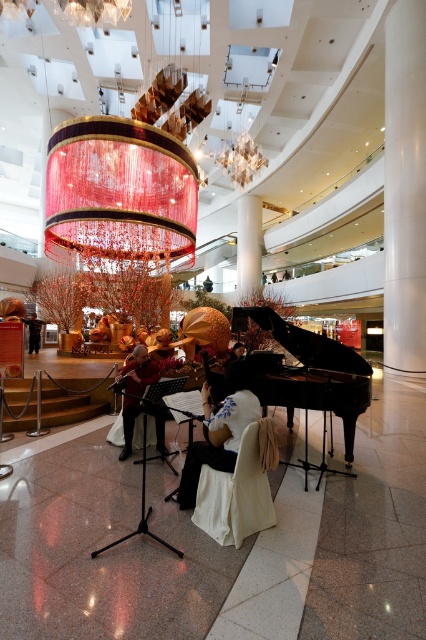
You are a photographer at the event and want to capture a photo of both the white satin dress at center and the dark brown leather jacket at center in the same frame. Which object should you focus on first to ensure both are in focus?

You should focus on the white satin dress at center first because it is smaller than the dark brown leather jacket at center, so focusing on the smaller object will help ensure both are in focus.

You are standing at the entrance of the atrium and want to find the black polished piano at center. According to the coordinates provided, where should you look relative to your current position?

The black polished piano at center is located at coordinates point (302,340), which means it is positioned slightly to the right and lower from your current position at the entrance.

You are standing in the atrium and want to take a photo of the black polished piano at center and the dark brown leather jacket at center. Which object should you focus on first to ensure both are in focus without moving the camera?

You should focus on the dark brown leather jacket at center first because it is farther away from the viewer than the black polished piano at center. By focusing on the farther object, both will be in focus due to the depth of field.